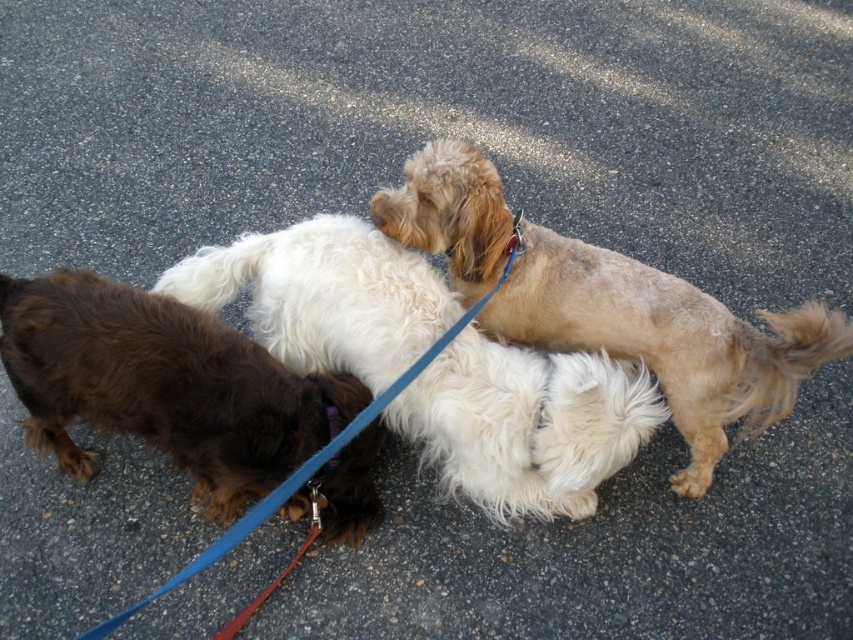
You are standing 2 meters away from the fluffy white dog at center. Can you reach the dog with a 1.5 meter long treat bag?

The distance between you and the fluffy white dog at center is 1.83 meters. Since your treat bag is 1.5 meters long, you cannot reach the dog because the distance is greater than the treat bag length.

You are a dog owner who wants to attach a new leash to your dog. You have a blue nylon leash at center and a purple fabric neckband at center in front of you. Which one is taller?

The blue nylon leash at center is much taller than the purple fabric neckband at center.